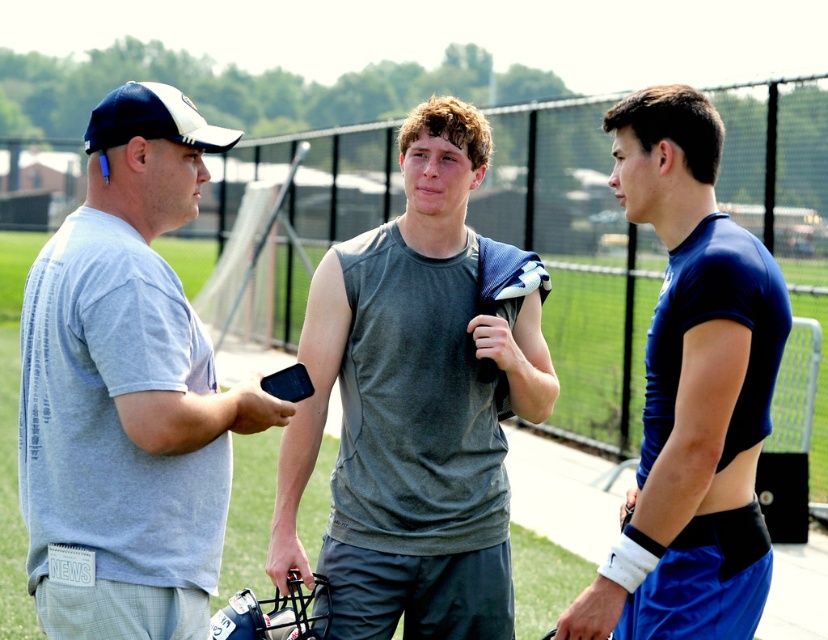
Question: Which object is closer to the camera taking this photo?

Choices:
 (A) gray matte tank top at center
 (B) gray cotton t-shirt at left
 (C) blue matte shirt at center
 (D) white matte baseball cap at upper left

Answer: (B)

Question: Which object is the farthest from the gray matte tank top at center?

Choices:
 (A) white matte baseball cap at upper left
 (B) gray cotton t-shirt at left

Answer: (A)

Question: Where is gray matte tank top at center located in relation to blue matte shirt at center in the image?

Choices:
 (A) left
 (B) right

Answer: (A)

Question: Which is farther from the gray cotton t-shirt at left?

Choices:
 (A) white matte baseball cap at upper left
 (B) gray matte tank top at center
 (C) blue matte shirt at center

Answer: (C)

Question: Is gray cotton t-shirt at left smaller than gray matte tank top at center?

Choices:
 (A) no
 (B) yes

Answer: (B)

Question: Is gray cotton t-shirt at left closer to the viewer compared to blue matte shirt at center?

Choices:
 (A) yes
 (B) no

Answer: (A)